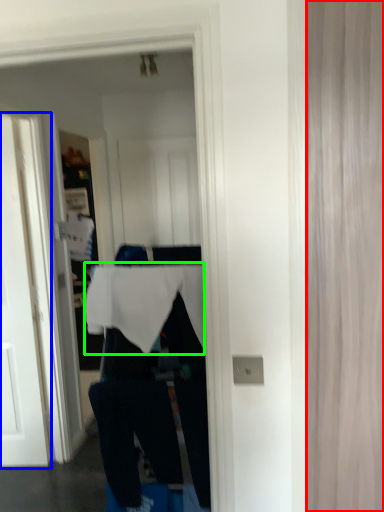
Question: Which is farther away from curtain (highlighted by a red box)? door (highlighted by a blue box) or tablecloth (highlighted by a green box)?

Choices:
 (A) door
 (B) tablecloth

Answer: (A)